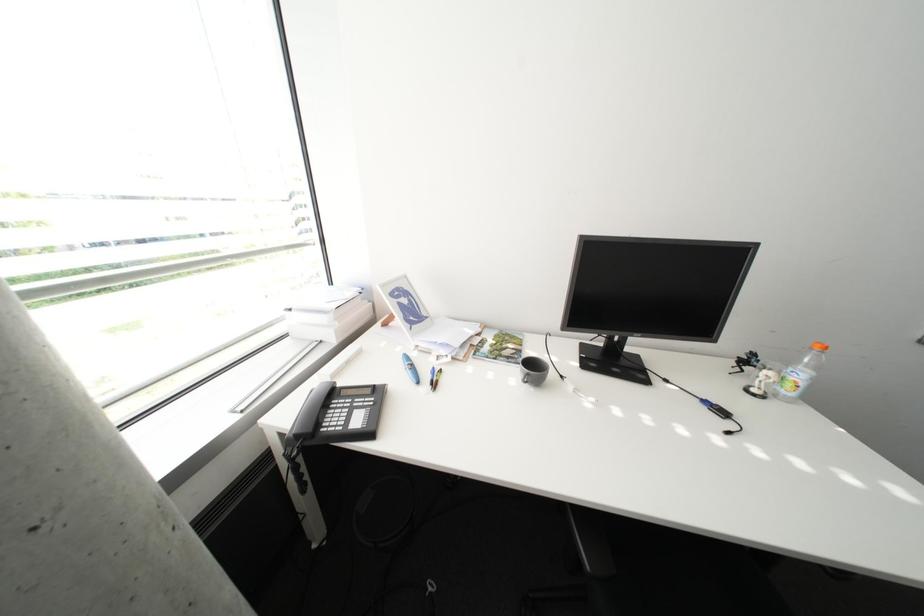
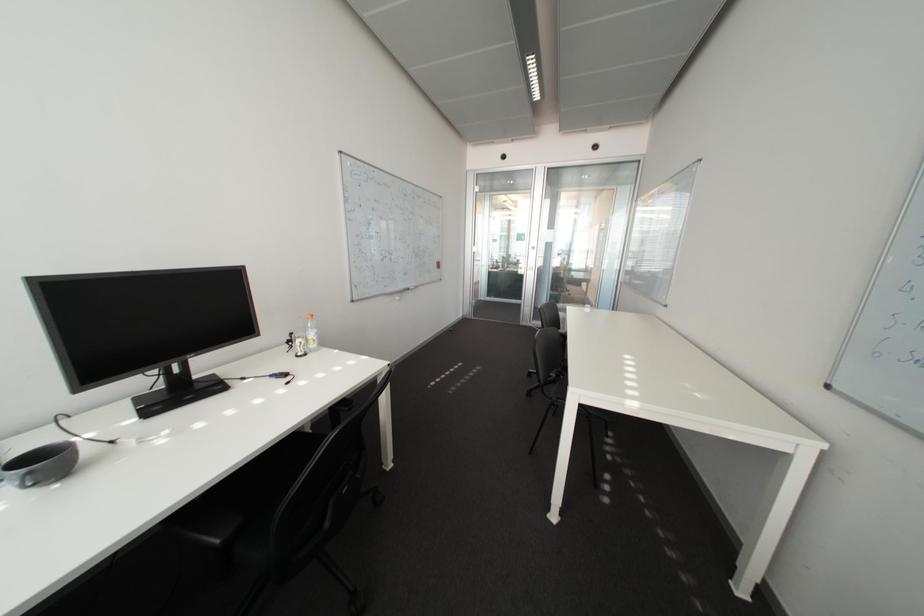
Question: The camera is either moving clockwise (left) or counter-clockwise (right) around the object. The first image is from the beginning of the video and the second image is from the end. Is the camera moving left or right when shooting the video?

Choices:
 (A) Left
 (B) Right

Answer: (A)